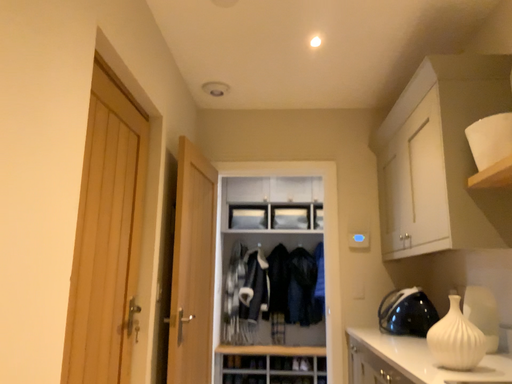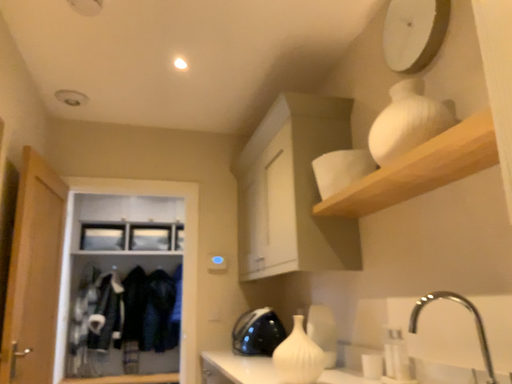
Question: Which way did the camera rotate in the video?

Choices:
 (A) rotated right
 (B) rotated left

Answer: (A)